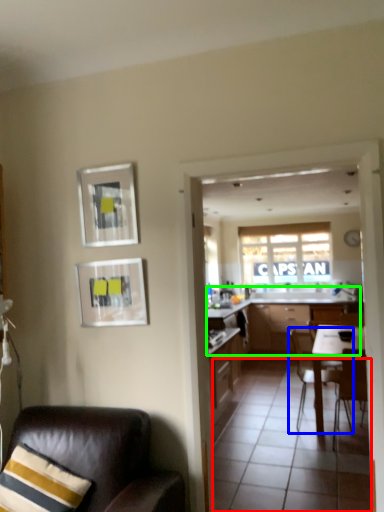
Question: Which object is the farthest from tile (highlighted by a red box)? Choose among these: chair (highlighted by a blue box) or cabinetry (highlighted by a green box).

Choices:
 (A) chair
 (B) cabinetry

Answer: (B)